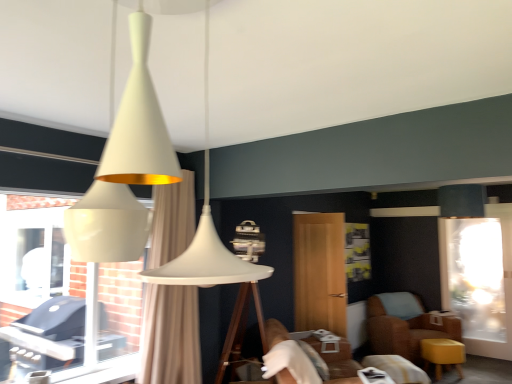
Question: Is the depth of wooden screen door at center, the 2th screen door from the back, less than that of matte yellow stool at lower right?

Choices:
 (A) no
 (B) yes

Answer: (B)

Question: Is wooden screen door at center, which ranks as the first screen door in left-to-right order, turned away from matte yellow stool at lower right?

Choices:
 (A) no
 (B) yes

Answer: (A)

Question: From a real-world perspective, is wooden screen door at center, the second screen door when ordered from right to left, on matte yellow stool at lower right?

Choices:
 (A) yes
 (B) no

Answer: (A)

Question: Is matte yellow stool at lower right a part of wooden screen door at center, which ranks as the first screen door in left-to-right order?

Choices:
 (A) yes
 (B) no

Answer: (B)

Question: From a real-world perspective, is wooden screen door at center, which appears as the first screen door when viewed from the front, under matte yellow stool at lower right?

Choices:
 (A) no
 (B) yes

Answer: (A)

Question: Choose the correct answer: Is white glossy grill at left inside transparent glass screen door at right, the 2th screen door viewed from the front, or outside it?

Choices:
 (A) inside
 (B) outside

Answer: (B)

Question: Considering the positions of white glossy grill at left and transparent glass screen door at right, placed as the 2th screen door when sorted from left to right, in the image, is white glossy grill at left wider or thinner than transparent glass screen door at right, placed as the 2th screen door when sorted from left to right,?

Choices:
 (A) thin
 (B) wide

Answer: (A)

Question: Considering the positions of point (67, 357) and point (443, 220), is point (67, 357) closer or farther from the camera than point (443, 220)?

Choices:
 (A) farther
 (B) closer

Answer: (B)

Question: Is white glossy grill at left taller or shorter than transparent glass screen door at right, placed as the 2th screen door when sorted from left to right?

Choices:
 (A) short
 (B) tall

Answer: (A)

Question: Would you say transparent glass screen door at right, the 2th screen door viewed from the front, is to the left or to the right of brown leather chair at lower right in the picture?

Choices:
 (A) right
 (B) left

Answer: (A)

Question: Considering the positions of transparent glass screen door at right, the 1th screen door in the right-to-left sequence, and brown leather chair at lower right in the image, is transparent glass screen door at right, the 1th screen door in the right-to-left sequence, taller or shorter than brown leather chair at lower right?

Choices:
 (A) tall
 (B) short

Answer: (A)

Question: Is transparent glass screen door at right, the first screen door positioned from the back, bigger or smaller than brown leather chair at lower right?

Choices:
 (A) big
 (B) small

Answer: (B)

Question: Considering their positions, is transparent glass screen door at right, placed as the 2th screen door when sorted from left to right, located in front of or behind brown leather chair at lower right?

Choices:
 (A) behind
 (B) front

Answer: (A)

Question: Considering the positions of white glossy grill at left and beige fabric curtain at center in the image, is white glossy grill at left wider or thinner than beige fabric curtain at center?

Choices:
 (A) wide
 (B) thin

Answer: (B)

Question: From a real-world perspective, is white glossy grill at left above or below beige fabric curtain at center?

Choices:
 (A) above
 (B) below

Answer: (A)